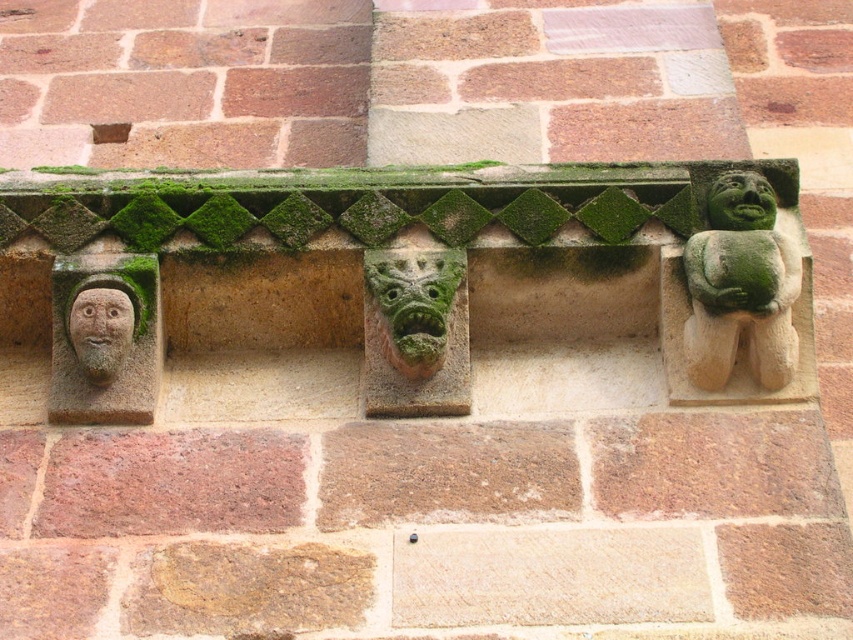
You are an architect examining the stone wall and its decorative elements. You notice the smooth stone face at left and the green stone face at upper right. Which of these two faces is taller?

The smooth stone face at left is taller than the green stone face at upper right.

You are standing in front of the stone wall and want to take a photo of the gray stone face at left. If your camera can focus up to 20 meters, will you be able to capture a clear image?

The gray stone face at left and camera are 22.65 meters apart from each other, which exceeds the camera focus limit of 20 meters. Therefore, the camera cannot focus clearly on the gray stone face at left.

You are an architect examining the stone wall and its decorative elements. You notice two stone faces, the gray stone face at left and the green stone face at upper right. Which of these two faces is located to the left of the other?

The gray stone face at left is positioned on the left side of the green stone face at upper right.